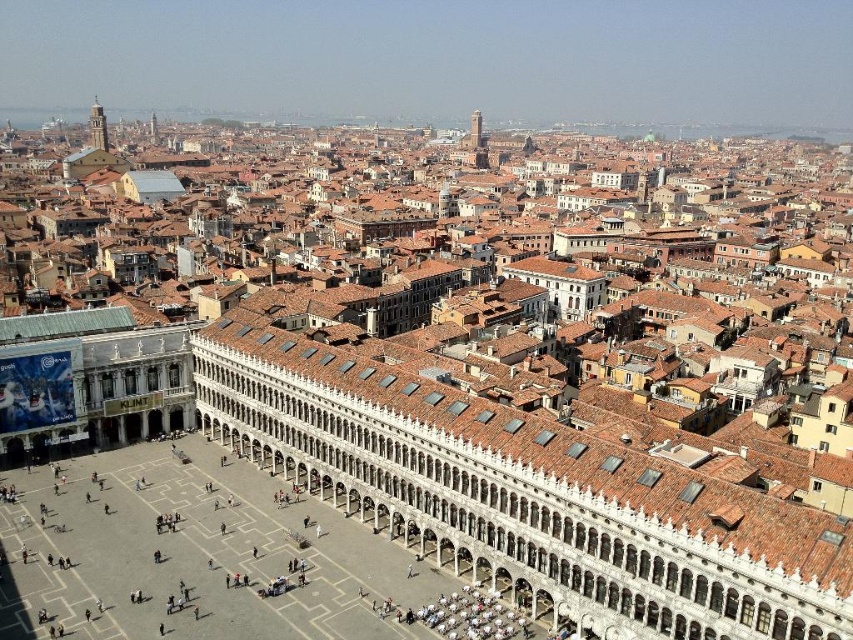
Question: Which point appears farthest from the camera in this image?

Choices:
 (A) (96, 108)
 (B) (480, 140)

Answer: (B)

Question: Can you confirm if smooth white tower at upper left is positioned below smooth stone tower at upper center?

Choices:
 (A) yes
 (B) no

Answer: (A)

Question: Does smooth white tower at upper left have a lesser width compared to smooth stone tower at upper center?

Choices:
 (A) yes
 (B) no

Answer: (B)

Question: Among these objects, which one is farthest from the camera?

Choices:
 (A) smooth stone tower at upper center
 (B) smooth white tower at upper left

Answer: (A)

Question: Among these objects, which one is nearest to the camera?

Choices:
 (A) smooth stone tower at upper center
 (B) smooth white tower at upper left

Answer: (B)

Question: Does smooth white tower at upper left appear over smooth stone tower at upper center?

Choices:
 (A) no
 (B) yes

Answer: (A)